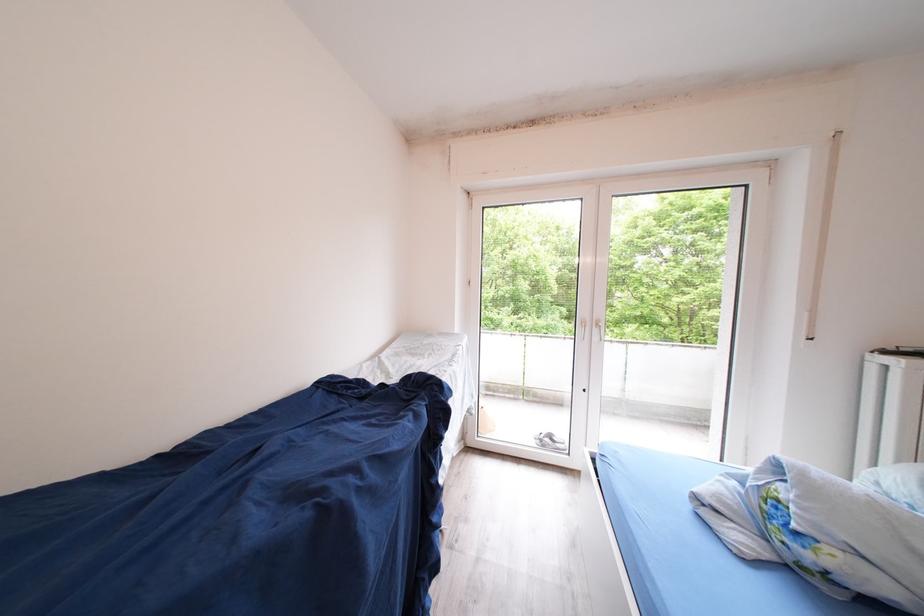
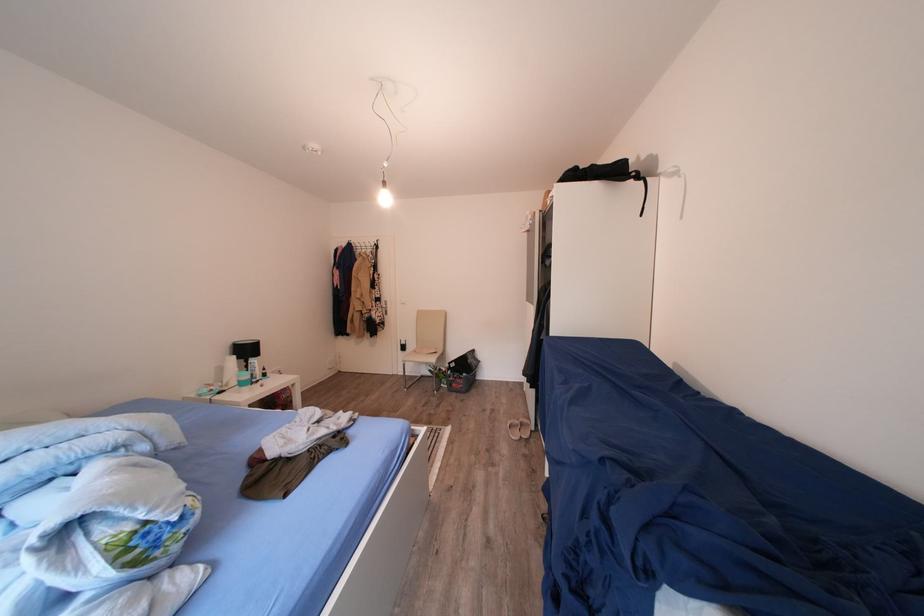
Locate, in the second image, the point that corresponds to (x=787, y=506) in the first image.

(142, 538)